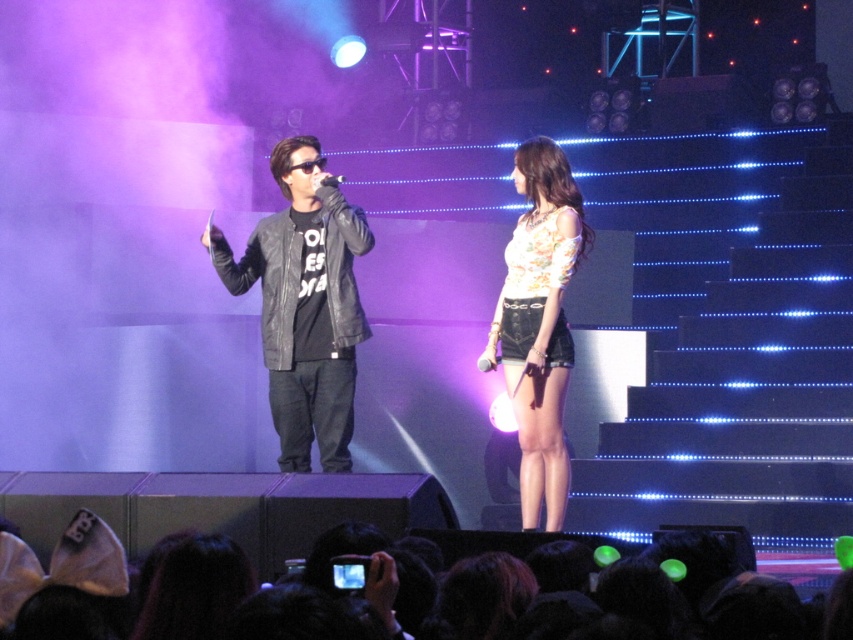
Question: Can you confirm if black leather jacket at center is positioned below floral fabric top at center?

Choices:
 (A) yes
 (B) no

Answer: (B)

Question: Which of the following is the farthest from the observer?

Choices:
 (A) black matte microphone at center
 (B) floral fabric top at center

Answer: (B)

Question: Which of the following is the farthest from the observer?

Choices:
 (A) black matte microphone at center
 (B) black leather jacket at center
 (C) floral fabric top at center

Answer: (C)

Question: Is floral fabric top at center wider than black matte microphone at center?

Choices:
 (A) yes
 (B) no

Answer: (A)

Question: Is black leather jacket at center to the right of black matte microphone at center from the viewer's perspective?

Choices:
 (A) no
 (B) yes

Answer: (A)

Question: Which point appears farthest from the camera in this image?

Choices:
 (A) (495, 333)
 (B) (334, 173)

Answer: (B)